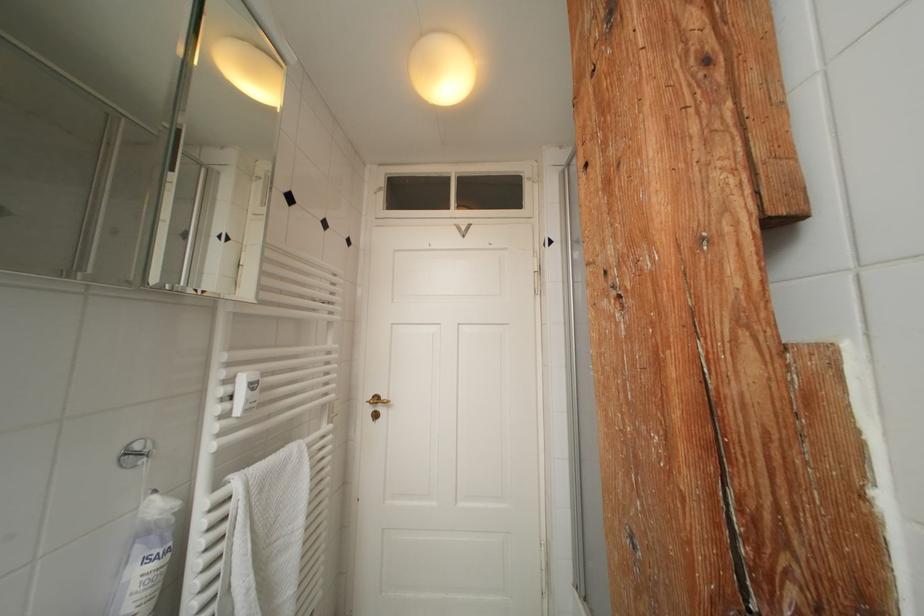
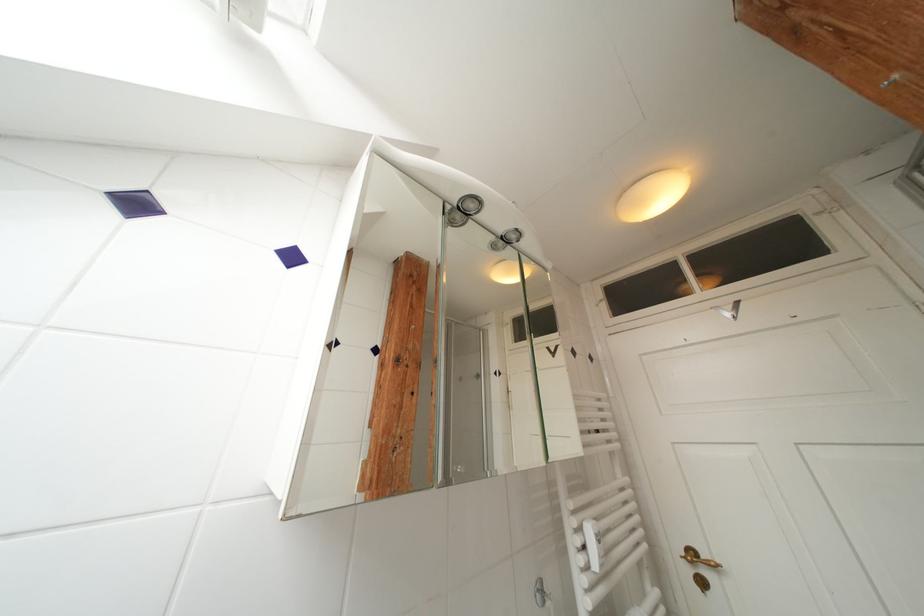
Find the pixel in the second image that matches pixel 383 402 in the first image.

(699, 557)